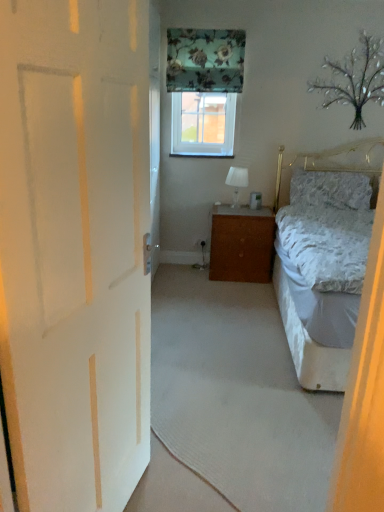
Question: Is clear glass window at center not inside white matte door at left?

Choices:
 (A) yes
 (B) no

Answer: (A)

Question: Is clear glass window at center bigger than white matte door at left?

Choices:
 (A) yes
 (B) no

Answer: (B)

Question: Is clear glass window at center smaller than white matte door at left?

Choices:
 (A) no
 (B) yes

Answer: (B)

Question: Does clear glass window at center have a lesser height compared to white matte door at left?

Choices:
 (A) no
 (B) yes

Answer: (B)

Question: Is clear glass window at center facing away from white matte door at left?

Choices:
 (A) no
 (B) yes

Answer: (A)

Question: Is clear glass window at center positioned behind white matte door at left?

Choices:
 (A) no
 (B) yes

Answer: (B)

Question: Is brown wood cabinet at center outside of fluffy white pillow at right?

Choices:
 (A) no
 (B) yes

Answer: (B)

Question: From a real-world perspective, does brown wood cabinet at center sit lower than fluffy white pillow at right?

Choices:
 (A) no
 (B) yes

Answer: (B)

Question: Is brown wood cabinet at center smaller than fluffy white pillow at right?

Choices:
 (A) yes
 (B) no

Answer: (B)

Question: Is brown wood cabinet at center in front of fluffy white pillow at right?

Choices:
 (A) no
 (B) yes

Answer: (B)

Question: Is the depth of brown wood cabinet at center greater than that of fluffy white pillow at right?

Choices:
 (A) no
 (B) yes

Answer: (A)

Question: From the image's perspective, is brown wood cabinet at center over fluffy white pillow at right?

Choices:
 (A) yes
 (B) no

Answer: (B)

Question: Is white matte door at left wider than fluffy white pillow at right?

Choices:
 (A) no
 (B) yes

Answer: (A)